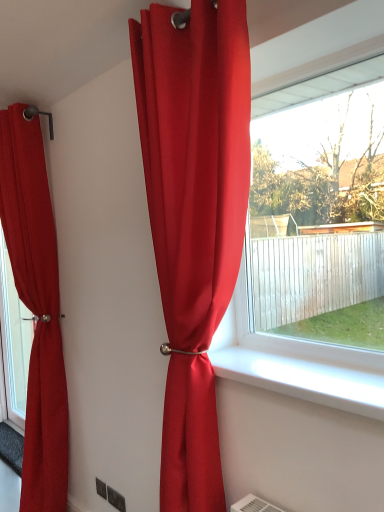
Describe the element at coordinates (36, 307) in the screenshot. Image resolution: width=384 pixels, height=512 pixels. I see `matte red curtain at left, marked as the second curtain in a right-to-left arrangement` at that location.

Locate an element on the screen. matte red curtain at center, the 1th curtain when ordered from right to left is located at coordinates (194, 217).

In terms of width, does matte red curtain at center, marked as the second curtain in a back-to-front arrangement, look wider or thinner when compared to matte red curtain at left, which is counted as the second curtain, starting from the front?

Clearly, matte red curtain at center, marked as the second curtain in a back-to-front arrangement, has less width compared to matte red curtain at left, which is counted as the second curtain, starting from the front.

From a real-world perspective, is matte red curtain at center, marked as the 2th curtain in a left-to-right arrangement, positioned over matte red curtain at left, placed as the first curtain when sorted from left to right, based on gravity?

Yes, from a real-world perspective, matte red curtain at center, marked as the 2th curtain in a left-to-right arrangement, is on top of matte red curtain at left, placed as the first curtain when sorted from left to right.

Is matte red curtain at center, placed as the first curtain when sorted from front to back, shorter than matte red curtain at left, marked as the second curtain in a right-to-left arrangement?

Indeed, matte red curtain at center, placed as the first curtain when sorted from front to back, has a lesser height compared to matte red curtain at left, marked as the second curtain in a right-to-left arrangement.

Considering the sizes of matte red curtain at center, marked as the 2th curtain in a left-to-right arrangement, and white smooth window sill at center in the image, is matte red curtain at center, marked as the 2th curtain in a left-to-right arrangement, taller or shorter than white smooth window sill at center?

Considering their sizes, matte red curtain at center, marked as the 2th curtain in a left-to-right arrangement, has more height than white smooth window sill at center.

From the picture: In terms of width, does matte red curtain at center, placed as the first curtain when sorted from front to back, look wider or thinner when compared to white smooth window sill at center?

Clearly, matte red curtain at center, placed as the first curtain when sorted from front to back, has less width compared to white smooth window sill at center.

In the image, is matte red curtain at center, marked as the 2th curtain in a left-to-right arrangement, on the left side or the right side of white smooth window sill at center?

Clearly, matte red curtain at center, marked as the 2th curtain in a left-to-right arrangement, is on the left of white smooth window sill at center in the image.

Is matte red curtain at center, marked as the 2th curtain in a left-to-right arrangement, surrounded by matte red curtain at left, the 1th curtain from the back?

No, matte red curtain at center, marked as the 2th curtain in a left-to-right arrangement, is not a part of matte red curtain at left, the 1th curtain from the back.

From the image's perspective, which one is positioned higher, matte red curtain at left, placed as the first curtain when sorted from left to right, or matte red curtain at center, placed as the first curtain when sorted from front to back?

matte red curtain at center, placed as the first curtain when sorted from front to back.

Is matte red curtain at left, which is counted as the second curtain, starting from the front, far away from matte red curtain at center, marked as the second curtain in a back-to-front arrangement?

That's right, there is a large distance between matte red curtain at left, which is counted as the second curtain, starting from the front, and matte red curtain at center, marked as the second curtain in a back-to-front arrangement.

Where is `curtain on the right of matte red curtain at left, placed as the first curtain when sorted from left to right`? The height and width of the screenshot is (512, 384). curtain on the right of matte red curtain at left, placed as the first curtain when sorted from left to right is located at coordinates (194, 217).

Does point (224, 352) lie in front of point (49, 214)?

That is True.

From a real-world perspective, is white smooth window sill at center located higher than matte red curtain at left, placed as the first curtain when sorted from left to right?

Actually, white smooth window sill at center is physically below matte red curtain at left, placed as the first curtain when sorted from left to right, in the real world.

You are a GUI agent. You are given a task and a screenshot of the screen. Output one action in this format:
    pyautogui.click(x=<x>, y=<y>)
    Task: Click on the window sill to the right of matte red curtain at left, the 1th curtain from the back
    The height and width of the screenshot is (512, 384).
    Given the screenshot: What is the action you would take?
    pyautogui.click(x=303, y=379)

Which object is closer to the camera taking this photo, white smooth window sill at center or matte red curtain at left, placed as the first curtain when sorted from left to right?

white smooth window sill at center is more forward.

Between white smooth window sill at center and matte red curtain at center, marked as the 2th curtain in a left-to-right arrangement, which one has smaller width?

matte red curtain at center, marked as the 2th curtain in a left-to-right arrangement, is thinner.

Does white smooth window sill at center have a lesser height compared to matte red curtain at center, marked as the 2th curtain in a left-to-right arrangement?

Indeed, white smooth window sill at center has a lesser height compared to matte red curtain at center, marked as the 2th curtain in a left-to-right arrangement.

In the scene shown: From the image's perspective, is white smooth window sill at center below matte red curtain at center, marked as the 2th curtain in a left-to-right arrangement?

Correct, white smooth window sill at center appears lower than matte red curtain at center, marked as the 2th curtain in a left-to-right arrangement, in the image.

Based on the photo, can you confirm if matte red curtain at left, marked as the second curtain in a right-to-left arrangement, is bigger than white smooth window sill at center?

Yes.

Is matte red curtain at left, marked as the second curtain in a right-to-left arrangement, shorter than white smooth window sill at center?

No.

In order to click on curtain that is the 1st one when counting upward from the white smooth window sill at center (from the image's perspective) in this screenshot , I will do `click(36, 307)`.

Can you confirm if matte red curtain at left, marked as the second curtain in a right-to-left arrangement, is wider than white smooth window sill at center?

Yes.

This screenshot has height=512, width=384. Identify the location of curtain located above the matte red curtain at left, placed as the first curtain when sorted from left to right (from a real-world perspective). tap(194, 217).

The width and height of the screenshot is (384, 512). In order to click on window sill located in front of the matte red curtain at center, marked as the second curtain in a back-to-front arrangement in this screenshot , I will do `click(303, 379)`.

Considering their positions, is matte red curtain at left, marked as the second curtain in a right-to-left arrangement, positioned closer to matte red curtain at center, marked as the second curtain in a back-to-front arrangement, than white smooth window sill at center?

white smooth window sill at center.

Considering their positions, is white smooth window sill at center positioned closer to matte red curtain at center, marked as the second curtain in a back-to-front arrangement, than matte red curtain at left, placed as the first curtain when sorted from left to right?

white smooth window sill at center.

From the picture: Estimate the real-world distances between objects in this image. Which object is closer to white smooth window sill at center, matte red curtain at center, the 1th curtain when ordered from right to left, or matte red curtain at left, the 1th curtain from the back?

The object closer to white smooth window sill at center is matte red curtain at center, the 1th curtain when ordered from right to left.

Looking at the image, which one is located closer to matte red curtain at left, which is counted as the second curtain, starting from the front, matte red curtain at center, marked as the second curtain in a back-to-front arrangement, or white smooth window sill at center?

matte red curtain at center, marked as the second curtain in a back-to-front arrangement, is closer to matte red curtain at left, which is counted as the second curtain, starting from the front.

Looking at the image, which one is located closer to matte red curtain at left, marked as the second curtain in a right-to-left arrangement, white smooth window sill at center or matte red curtain at center, marked as the 2th curtain in a left-to-right arrangement?

matte red curtain at center, marked as the 2th curtain in a left-to-right arrangement, lies closer to matte red curtain at left, marked as the second curtain in a right-to-left arrangement, than the other object.

Looking at the image, which one is located closer to white smooth window sill at center, matte red curtain at left, which is counted as the second curtain, starting from the front, or matte red curtain at center, marked as the 2th curtain in a left-to-right arrangement?

matte red curtain at center, marked as the 2th curtain in a left-to-right arrangement.

At what (x,y) coordinates should I click in order to perform the action: click on curtain between matte red curtain at left, placed as the first curtain when sorted from left to right, and white smooth window sill at center, in the horizontal direction. Please return your answer as a coordinate pair (x, y). Looking at the image, I should click on (194, 217).